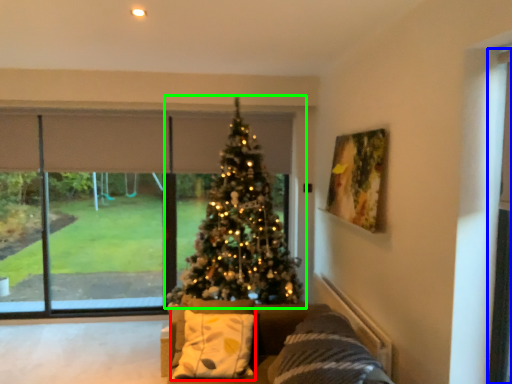
Question: Considering the real-world distances, which object is farthest from pillow (highlighted by a red box)? screen door (highlighted by a blue box) or christmas tree (highlighted by a green box)?

Choices:
 (A) screen door
 (B) christmas tree

Answer: (A)